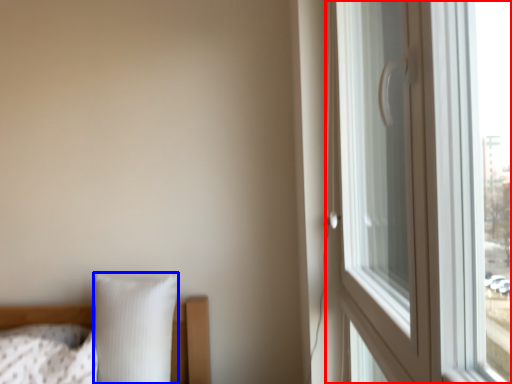
Question: Which of the following is the closest to the observer, window (highlighted by a red box) or pillow (highlighted by a blue box)?

Choices:
 (A) window
 (B) pillow

Answer: (A)